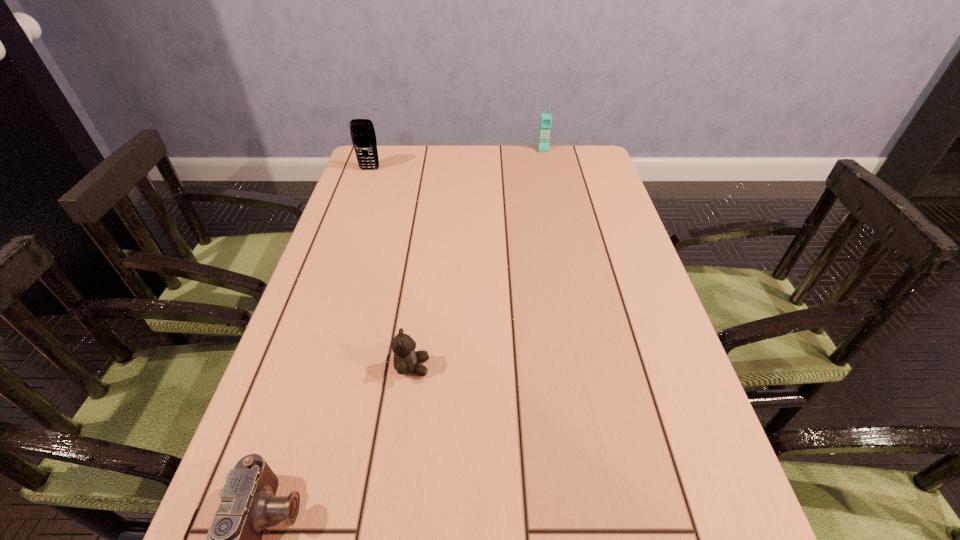
You are a GUI agent. You are given a task and a screenshot of the screen. Output one action in this format:
    pyautogui.click(x=<x>, y=<y>)
    Task: Click on the farthest object
    
    Given the screenshot: What is the action you would take?
    pyautogui.click(x=545, y=122)

What are the coordinates of `the right cellular telephone` in the screenshot? It's located at (545, 122).

Locate an element on the screen. the second farthest object is located at coordinates pos(363,136).

The width and height of the screenshot is (960, 540). What are the coordinates of `the nearer cellular telephone` in the screenshot? It's located at (363, 136).

This screenshot has height=540, width=960. Identify the location of teddy bear. click(x=406, y=360).

At what (x,y) coordinates should I click in order to perform the action: click on the second nearest object. Please return your answer as a coordinate pair (x, y). Looking at the image, I should click on (406, 360).

I want to click on free space located on the keypad of the rightmost object, so click(555, 205).

The width and height of the screenshot is (960, 540). Find the location of `blank space located 0.400m on the screen of the third nearest object`. blank space located 0.400m on the screen of the third nearest object is located at coordinates (340, 254).

Image resolution: width=960 pixels, height=540 pixels. In order to click on free space located 0.280m on the face of the teddy bear in this screenshot , I will do `click(570, 367)`.

This screenshot has height=540, width=960. Identify the location of object that is at the left edge. (363, 136).